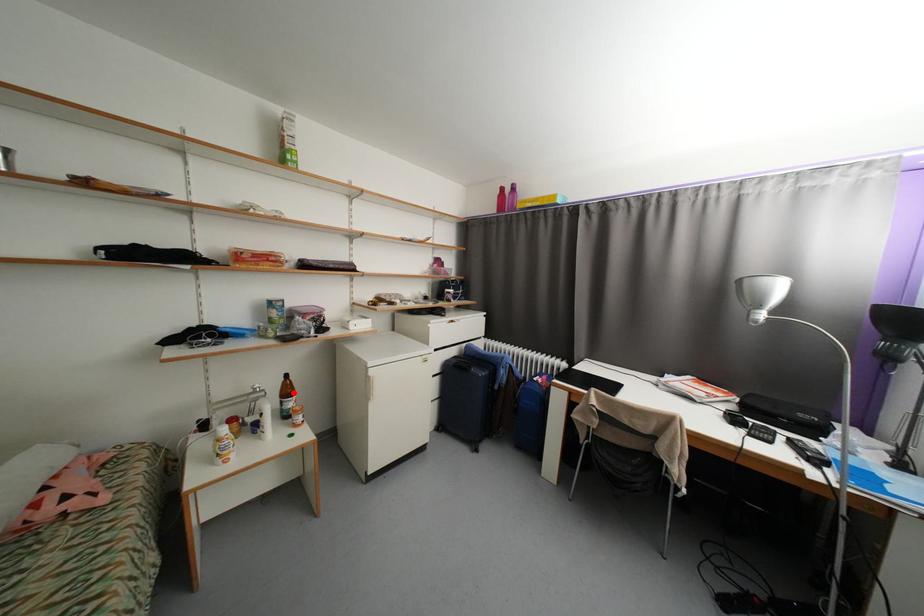
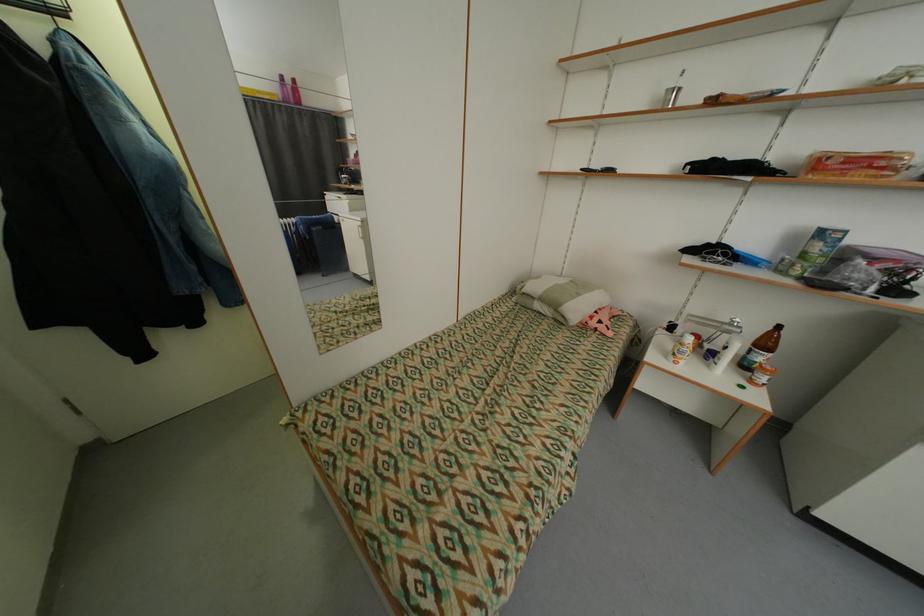
Question: I am providing you with two images of the same scene from different viewpoints. Given a red point in image1, look at the same physical point in image2. Is it:

Choices:
 (A) Closer to the viewpoint
 (B) Farther from the viewpoint

Answer: (B)